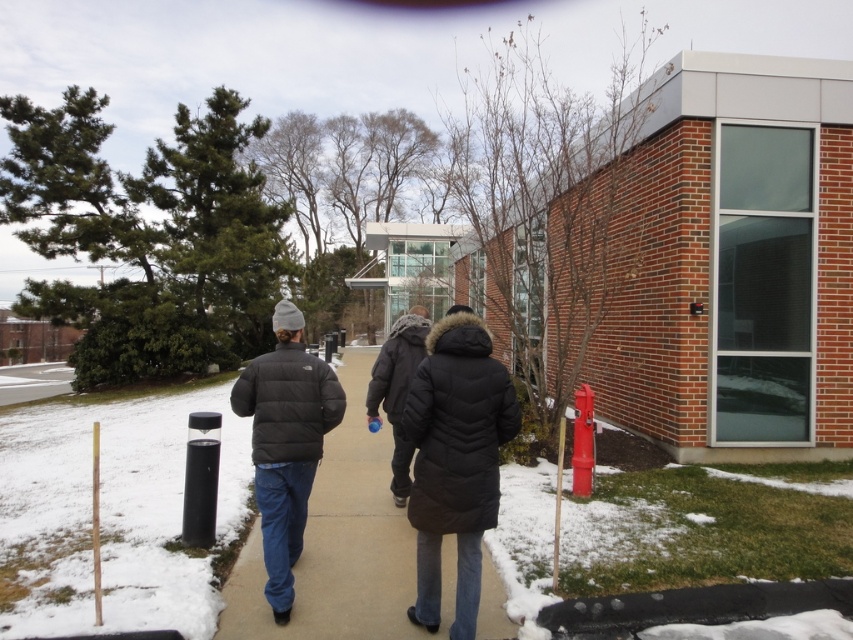
Can you confirm if black puffer jacket at center is positioned to the right of matte black puffer jacket at center?

In fact, black puffer jacket at center is to the left of matte black puffer jacket at center.

The height and width of the screenshot is (640, 853). Find the location of `black puffer jacket at center`. black puffer jacket at center is located at coordinates (338, 544).

Can you confirm if black puffer jacket at center is bigger than black puffer coat at center?

Yes, black puffer jacket at center is bigger than black puffer coat at center.

Who is shorter, black puffer jacket at center or black puffer coat at center?

black puffer jacket at center is shorter.

Which is behind, point (358, 445) or point (437, 625)?

The point (358, 445) is more distant.

Locate an element on the screen. The width and height of the screenshot is (853, 640). black puffer jacket at center is located at coordinates (338, 544).

Which is in front, point (474, 388) or point (331, 410)?

Point (474, 388)

This screenshot has width=853, height=640. I want to click on black puffer coat at center, so click(456, 460).

Find the location of a particular element. The image size is (853, 640). black puffer coat at center is located at coordinates (456, 460).